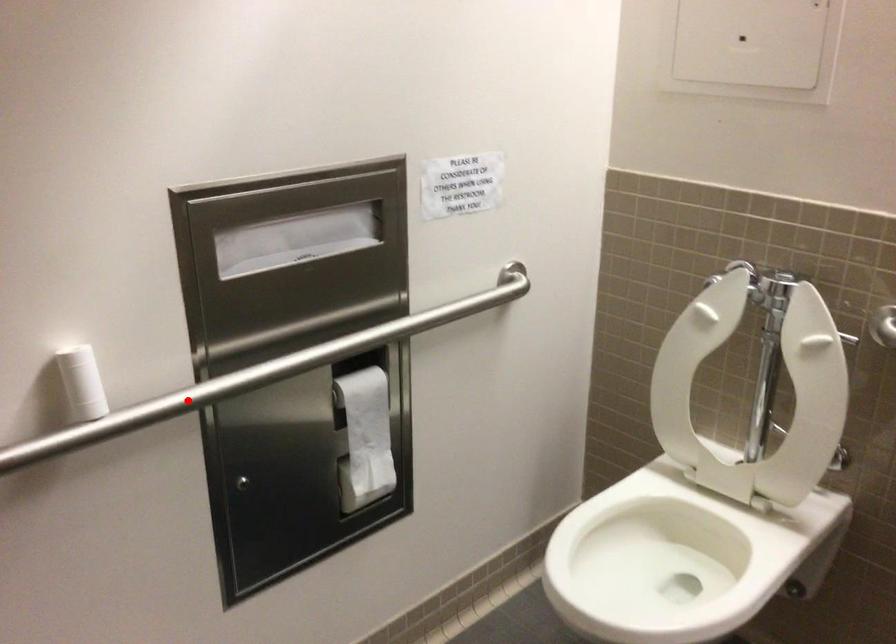
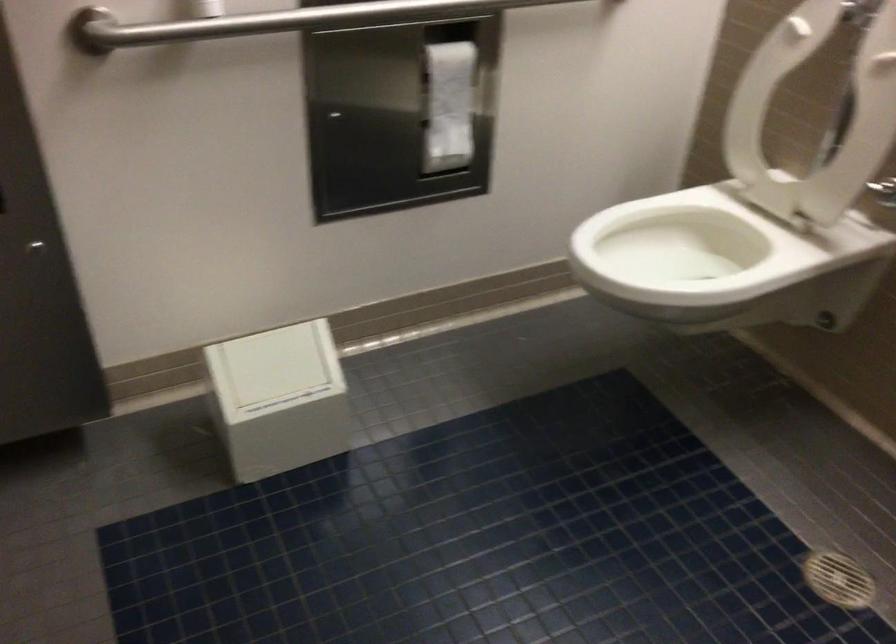
Question: I am providing you with two images of the same scene from different viewpoints. Image1 has a red point marked. In image2, the corresponding 3D location appears at what relative position? Reply with the corresponding letter.

Choices:
 (A) Closer
 (B) Farther

Answer: (B)